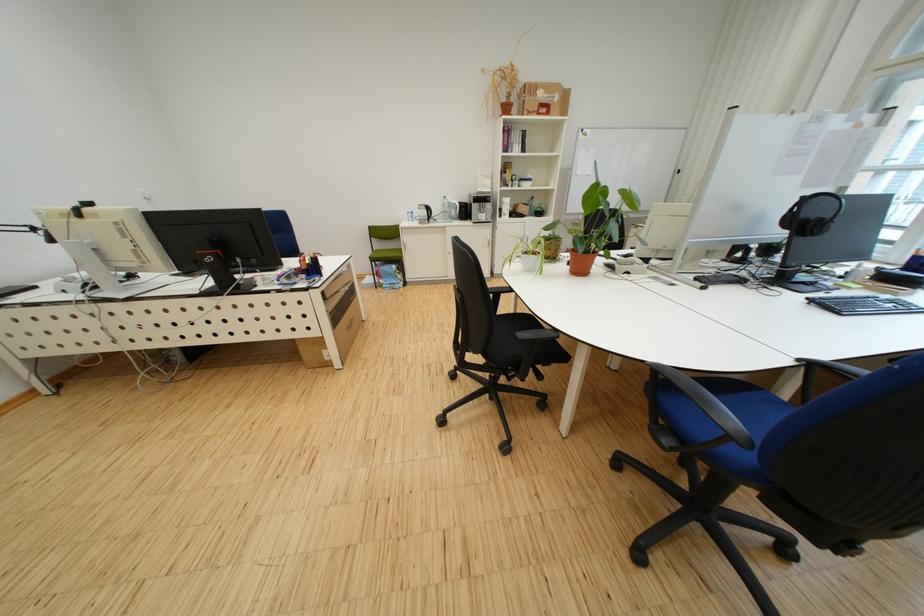
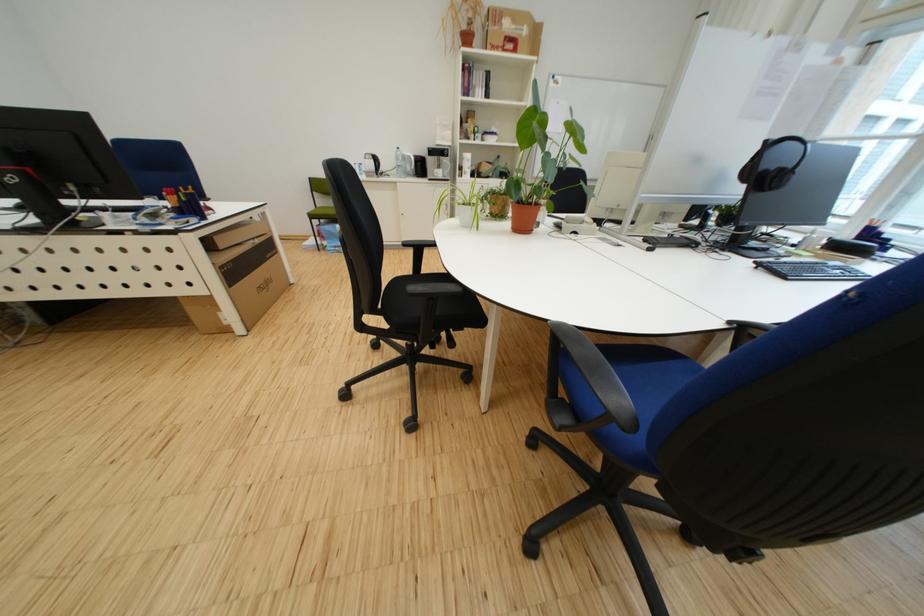
Question: Based on the continuous images, in which direction is the camera rotating? Reply with the corresponding letter.

Choices:
 (A) Left
 (B) Right
 (C) Up
 (D) Down

Answer: (D)